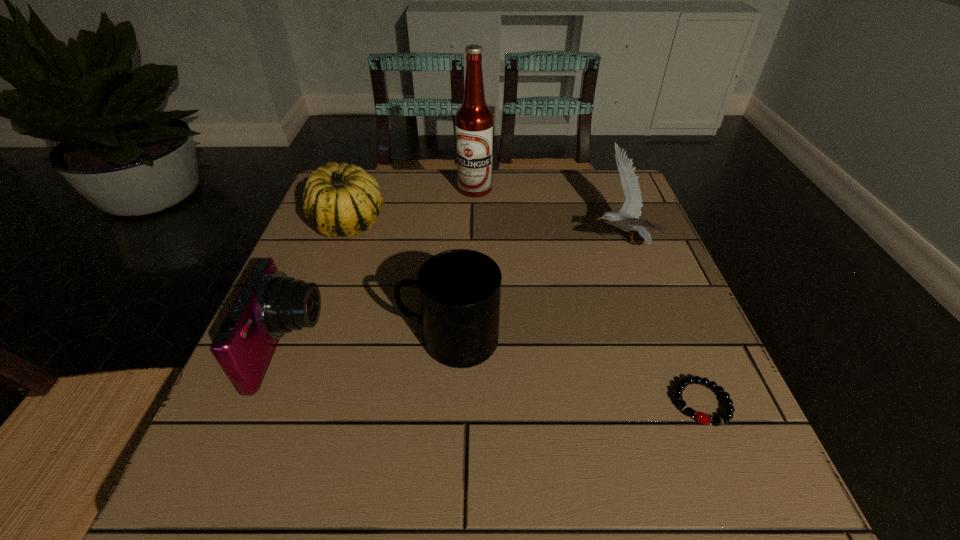
The width and height of the screenshot is (960, 540). In order to click on free region at the near left corner of the desktop in this screenshot , I will do `click(238, 457)`.

You are a GUI agent. You are given a task and a screenshot of the screen. Output one action in this format:
    pyautogui.click(x=<x>, y=<y>)
    Task: Click on the free region at the far right corner of the desktop
    This screenshot has width=960, height=540.
    Given the screenshot: What is the action you would take?
    pyautogui.click(x=598, y=205)

This screenshot has height=540, width=960. In the image, there is a desktop. In order to click on vacant space at the near right corner in this screenshot , I will do `click(762, 460)`.

This screenshot has width=960, height=540. Identify the location of vacant region between the camera and the tallest object. (382, 269).

In order to click on vacant space that's between the bracelet and the camera in this screenshot , I will do `click(495, 375)`.

Where is `vacant space that is in between the camera and the mug`? The height and width of the screenshot is (540, 960). vacant space that is in between the camera and the mug is located at coordinates click(x=370, y=345).

Identify the location of free point between the gourd and the gull. (485, 233).

The image size is (960, 540). Identify the location of free space between the camera and the tallest object. (382, 269).

You are a GUI agent. You are given a task and a screenshot of the screen. Output one action in this format:
    pyautogui.click(x=<x>, y=<y>)
    Task: Click on the free space between the tallest object and the gourd
    This screenshot has width=960, height=540.
    Given the screenshot: What is the action you would take?
    pyautogui.click(x=412, y=206)

I want to click on free point between the shortest object and the gourd, so click(x=525, y=313).